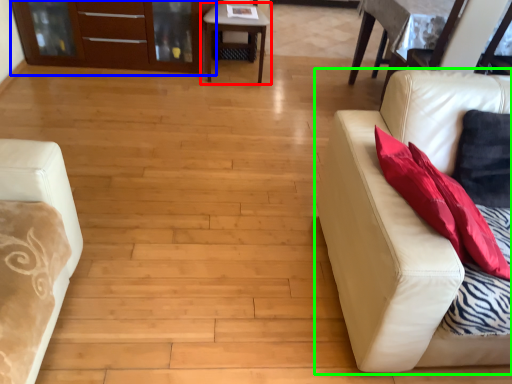
Question: Which object is the closest to the table (highlighted by a red box)? Choose among these: dresser (highlighted by a blue box) or studio couch (highlighted by a green box).

Choices:
 (A) dresser
 (B) studio couch

Answer: (A)